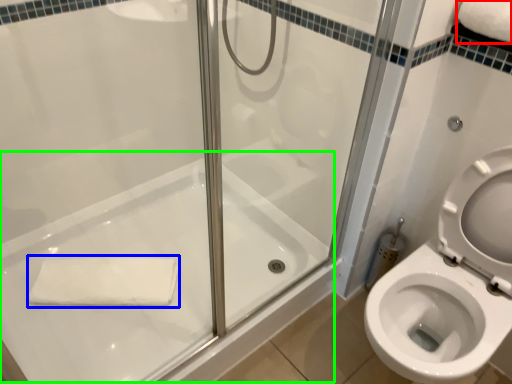
Question: Based on their relative distances, which object is farther from bath towel (highlighted by a red box)? Choose from bath towel (highlighted by a blue box) and bath (highlighted by a green box).

Choices:
 (A) bath towel
 (B) bath

Answer: (A)